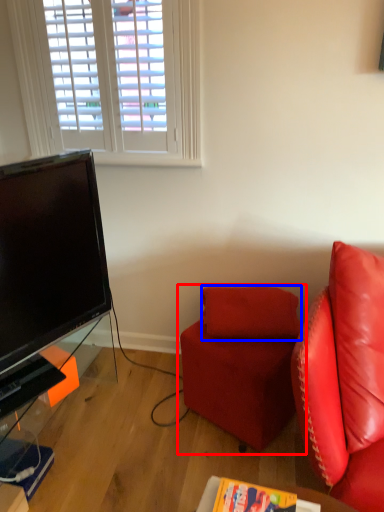
Question: Which of the following is the farthest to the observer, studio couch (highlighted by a red box) or pillow (highlighted by a blue box)?

Choices:
 (A) studio couch
 (B) pillow

Answer: (B)